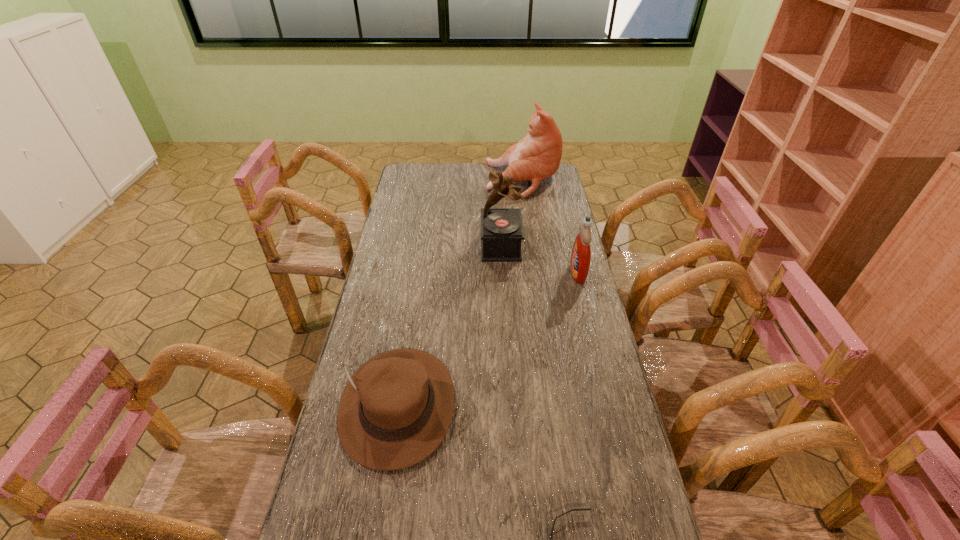
Locate an element on the screen. the farthest object is located at coordinates pyautogui.click(x=536, y=157).

Find the location of a particular element. Image resolution: width=960 pixels, height=540 pixels. phonograph_record is located at coordinates (502, 232).

I want to click on the third tallest object, so click(x=580, y=259).

Locate an element on the screen. Image resolution: width=960 pixels, height=540 pixels. fedora is located at coordinates (396, 409).

Identify the location of the fourth tallest object. (396, 409).

You are a GUI agent. You are given a task and a screenshot of the screen. Output one action in this format:
    pyautogui.click(x=<x>, y=<y>)
    Task: Click on the blank space located 0.290m on the face of the farthest object
    The width and height of the screenshot is (960, 540).
    Given the screenshot: What is the action you would take?
    pyautogui.click(x=425, y=180)

Identify the location of vacant space located on the face of the farthest object. (450, 180).

The image size is (960, 540). I want to click on blank space located on the face of the farthest object, so click(x=440, y=180).

Where is `vacant space located 0.150m at the horn opening of the phonograph_record`? Image resolution: width=960 pixels, height=540 pixels. vacant space located 0.150m at the horn opening of the phonograph_record is located at coordinates (443, 246).

The height and width of the screenshot is (540, 960). I want to click on vacant space located at the horn opening of the phonograph_record, so click(x=415, y=246).